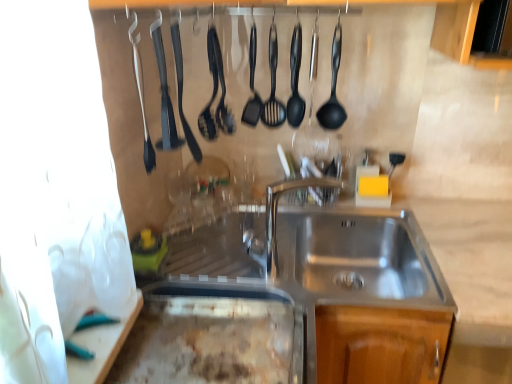
Question: Does black rubber spatula at upper center, placed as the second silverware when sorted from left to right, have a greater width compared to black rubber spatula at upper left, which is the 3th silverware in right-to-left order?

Choices:
 (A) yes
 (B) no

Answer: (B)

Question: Is black rubber spatula at upper center, acting as the second silverware starting from the right, facing away from black rubber spatula at upper left, which is the 3th silverware in right-to-left order?

Choices:
 (A) yes
 (B) no

Answer: (B)

Question: Could black rubber spatula at upper left, the first silverware when ordered from left to right, be considered to be inside black rubber spatula at upper center, acting as the second silverware starting from the right?

Choices:
 (A) no
 (B) yes

Answer: (A)

Question: Is black rubber spatula at upper center, placed as the second silverware when sorted from left to right, facing towards black rubber spatula at upper left, which is the 3th silverware in right-to-left order?

Choices:
 (A) yes
 (B) no

Answer: (B)

Question: From the image's perspective, is black rubber spatula at upper center, acting as the second silverware starting from the right, above black rubber spatula at upper left, the first silverware when ordered from left to right?

Choices:
 (A) no
 (B) yes

Answer: (B)

Question: From a real-world perspective, is black rubber spatula at upper center, acting as the second silverware starting from the right, beneath black rubber spatula at upper left, the first silverware when ordered from left to right?

Choices:
 (A) no
 (B) yes

Answer: (A)

Question: Could you tell me if polished stainless steel faucet at center is facing black rubber spatula at center, which is the third utensil from right to left?

Choices:
 (A) no
 (B) yes

Answer: (A)

Question: Can you confirm if polished stainless steel faucet at center is bigger than black rubber spatula at center, which is the third utensil from right to left?

Choices:
 (A) no
 (B) yes

Answer: (B)

Question: From a real-world perspective, is polished stainless steel faucet at center on top of black rubber spatula at center, which is the third utensil from right to left?

Choices:
 (A) no
 (B) yes

Answer: (A)

Question: Is black rubber spatula at center, which appears as the 1th utensil when viewed from the left, at the back of polished stainless steel faucet at center?

Choices:
 (A) yes
 (B) no

Answer: (B)

Question: Does polished stainless steel faucet at center appear on the right side of black rubber spatula at center, which appears as the 1th utensil when viewed from the left?

Choices:
 (A) no
 (B) yes

Answer: (B)

Question: Is polished stainless steel faucet at center beside black rubber spatula at center, which appears as the 1th utensil when viewed from the left?

Choices:
 (A) yes
 (B) no

Answer: (B)

Question: Can you confirm if black rubber spatula at upper center, acting as the second silverware starting from the right, is positioned to the left of black rubber spatula at center, which appears as the 1th utensil when viewed from the left?

Choices:
 (A) no
 (B) yes

Answer: (B)